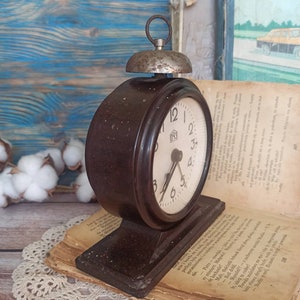
Image resolution: width=300 pixels, height=300 pixels. Find the location of `table`. table is located at coordinates (31, 219).